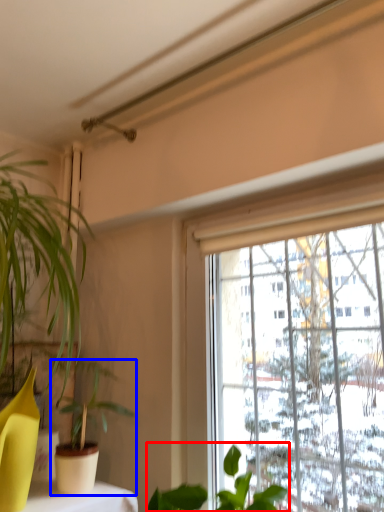
Question: Among these objects, which one is farthest to the camera, houseplant (highlighted by a red box) or houseplant (highlighted by a blue box)?

Choices:
 (A) houseplant
 (B) houseplant

Answer: (B)